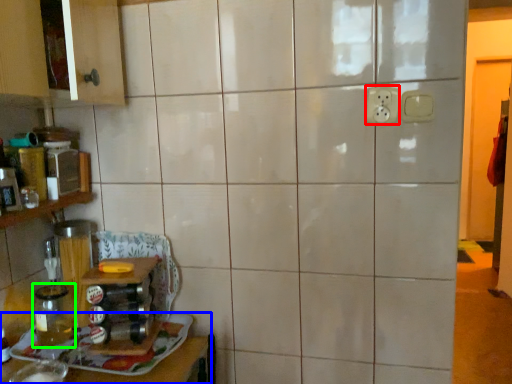
Question: Estimate the real-world distances between objects in this image. Which object is closer to electric outlet (highlighted by a red box), furniture (highlighted by a blue box) or glass jar (highlighted by a green box)?

Choices:
 (A) furniture
 (B) glass jar

Answer: (A)